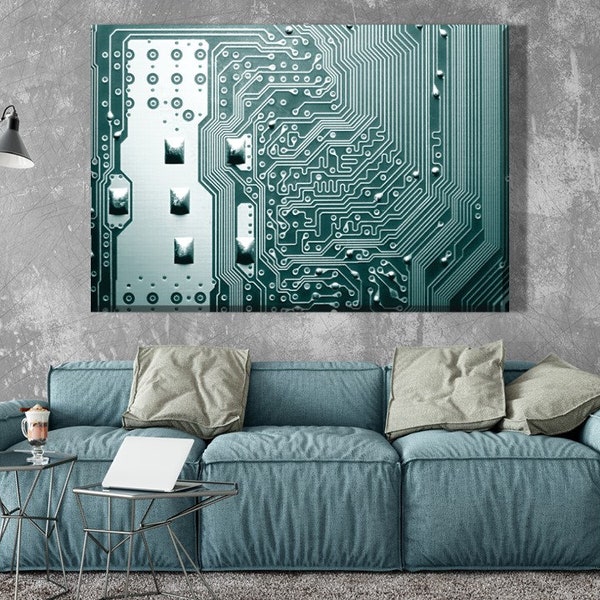
Locate an element on the screen. The width and height of the screenshot is (600, 600). seat cushions is located at coordinates (84, 436), (297, 468), (467, 457).